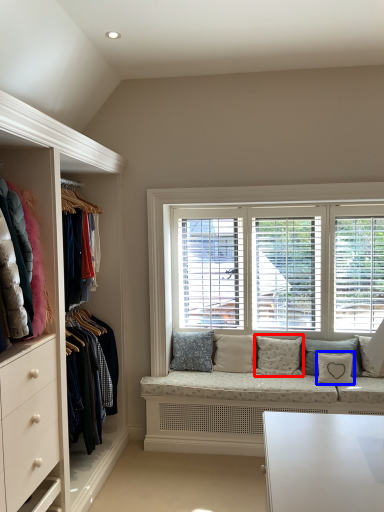
Question: Among these objects, which one is farthest to the camera, pillow (highlighted by a red box) or pillow (highlighted by a blue box)?

Choices:
 (A) pillow
 (B) pillow

Answer: (A)